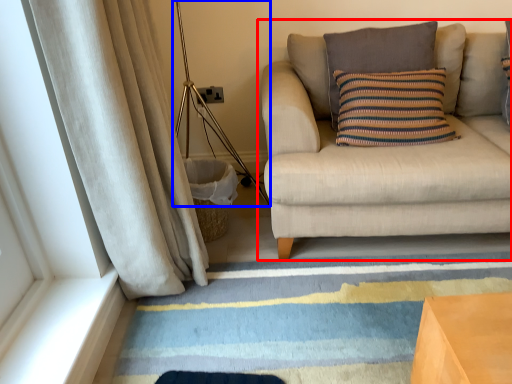
Question: Which object is closer to the camera taking this photo, studio couch (highlighted by a red box) or lamp (highlighted by a blue box)?

Choices:
 (A) studio couch
 (B) lamp

Answer: (A)